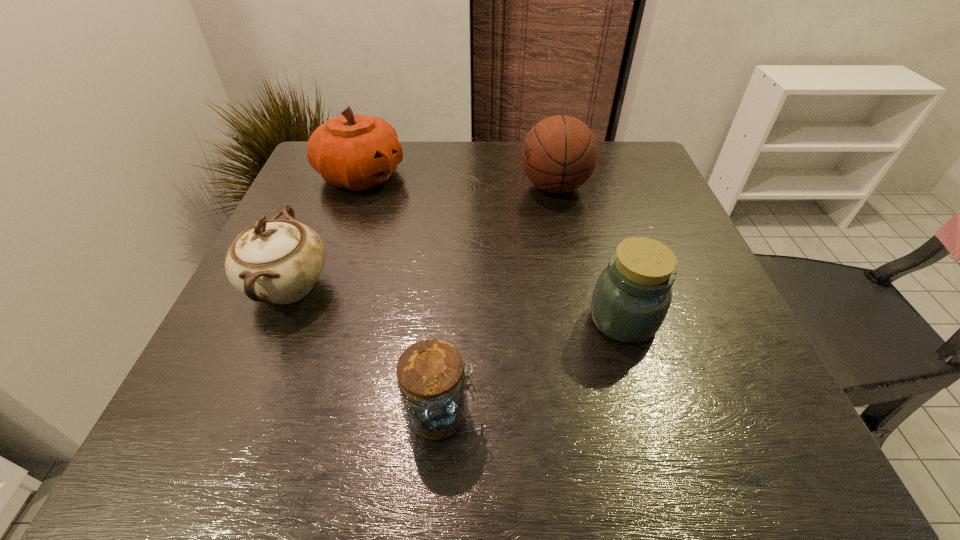
Locate an element on the screen. unoccupied position between the pumpkin and the basketball is located at coordinates (458, 181).

Locate an element on the screen. The height and width of the screenshot is (540, 960). vacant area that lies between the pumpkin and the basketball is located at coordinates (458, 181).

You are a GUI agent. You are given a task and a screenshot of the screen. Output one action in this format:
    pyautogui.click(x=<x>, y=<y>)
    Task: Click on the free point between the pumpkin and the shortest object
    This screenshot has height=540, width=960.
    Given the screenshot: What is the action you would take?
    pyautogui.click(x=400, y=295)

Locate an element on the screen. This screenshot has width=960, height=540. free spot between the farther jar and the pumpkin is located at coordinates (492, 247).

The width and height of the screenshot is (960, 540). Identify the location of blank region between the pumpkin and the basketball. (458, 181).

Locate an element on the screen. free space between the shortest object and the right jar is located at coordinates (532, 367).

Identify the location of vacant area between the shortest object and the pumpkin. (400, 295).

Where is `object that is the second closest one to the pumpkin`? The image size is (960, 540). object that is the second closest one to the pumpkin is located at coordinates pyautogui.click(x=559, y=154).

Find the location of `object that is the fourth nearest to the taller jar`. object that is the fourth nearest to the taller jar is located at coordinates (353, 151).

Find the location of `free space that satisfies the following two spatial constraints: 1. on the side with brand label of the basketball; 2. on the front side of the chinaware`. free space that satisfies the following two spatial constraints: 1. on the side with brand label of the basketball; 2. on the front side of the chinaware is located at coordinates (576, 287).